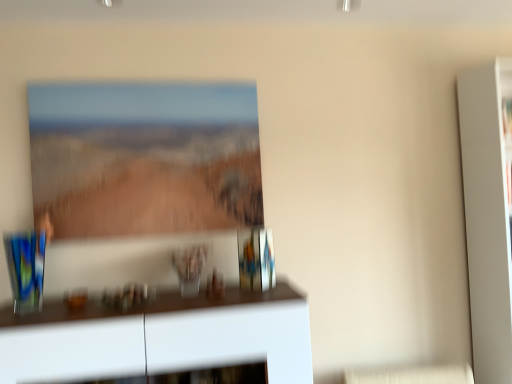
Identify the location of blank space situated above white glossy cabinet at lower center (from a real-world perspective). Image resolution: width=512 pixels, height=384 pixels. (118, 305).